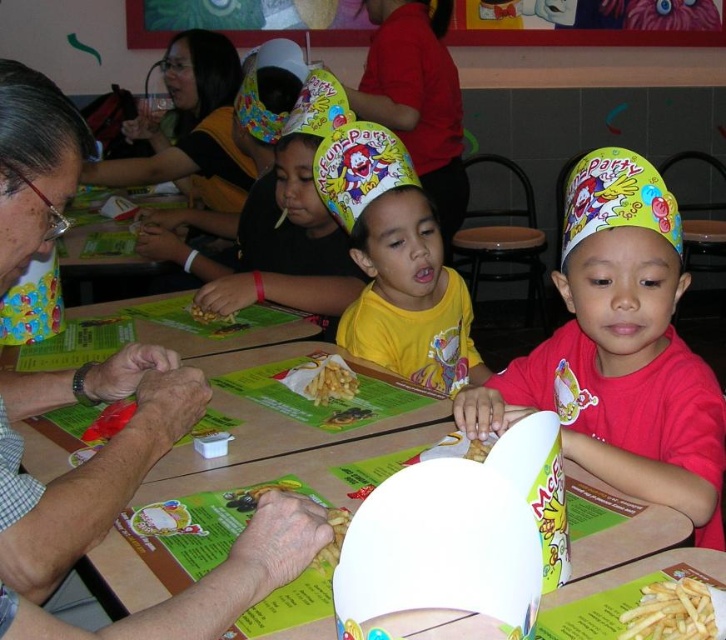
Question: Which of the following is the closest to the observer?

Choices:
 (A) yellow matte hat at center
 (B) matte yellow hat at upper center
 (C) golden crispy french fries at center
 (D) matte yellow paper hat at center

Answer: (B)

Question: Can you confirm if yellow matte hat at center is positioned above yellow matte french fries at center?

Choices:
 (A) yes
 (B) no

Answer: (A)

Question: Which point appears closest to the camera in this image?

Choices:
 (A) (219, 324)
 (B) (187, 428)
 (C) (656, 612)

Answer: (C)

Question: Is matte yellow hat at upper center wider than yellow matte french fries at center?

Choices:
 (A) no
 (B) yes

Answer: (B)

Question: Can you confirm if matte yellow hat at upper center is positioned below yellow matte paper hat at center?

Choices:
 (A) yes
 (B) no

Answer: (A)

Question: Which object is positioned farthest from the golden crispy fries at lower right?

Choices:
 (A) yellow matte paper hat at center
 (B) golden crispy fries at center

Answer: (A)